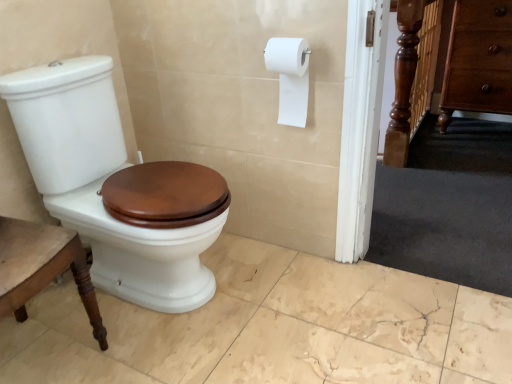
This screenshot has width=512, height=384. What do you see at coordinates (479, 58) in the screenshot?
I see `brown wood drawer at right` at bounding box center [479, 58].

Measure the distance between white glossy toilet at left and camera.

They are 1.28 meters apart.

The height and width of the screenshot is (384, 512). I want to click on white glossy toilet at left, so click(102, 183).

The width and height of the screenshot is (512, 384). I want to click on brown wood drawer at right, so click(x=479, y=58).

Considering the positions of objects white matte toilet paper at upper right and brown wood drawer at right in the image provided, who is more to the right, white matte toilet paper at upper right or brown wood drawer at right?

brown wood drawer at right is more to the right.

Considering the relative sizes of white matte toilet paper at upper right and brown wood drawer at right in the image provided, is white matte toilet paper at upper right wider than brown wood drawer at right?

No.

Considering the sizes of objects white matte toilet paper at upper right and brown wood drawer at right in the image provided, who is bigger, white matte toilet paper at upper right or brown wood drawer at right?

brown wood drawer at right is bigger.

Which is closer to the camera, (297,53) or (452,70)?

Point (297,53)

Which of these two, brown wood drawer at right or white matte toilet paper at upper right, is smaller?

white matte toilet paper at upper right.

Could you tell me if brown wood drawer at right is facing white matte toilet paper at upper right?

Yes, brown wood drawer at right is oriented towards white matte toilet paper at upper right.

Which is more to the left, brown wood drawer at right or white matte toilet paper at upper right?

white matte toilet paper at upper right.

Looking at their sizes, would you say brown wood drawer at right is wider or thinner than white matte toilet paper at upper right?

Clearly, brown wood drawer at right has more width compared to white matte toilet paper at upper right.

Is white glossy toilet at left thinner than brown wood drawer at right?

No, white glossy toilet at left is not thinner than brown wood drawer at right.

Would you say white glossy toilet at left is outside brown wood drawer at right?

white glossy toilet at left lies outside brown wood drawer at right's area.

Is white glossy toilet at left far from brown wood drawer at right?

Absolutely, white glossy toilet at left is distant from brown wood drawer at right.

Which object is further away from the camera, white glossy toilet at left or brown wood drawer at right?

brown wood drawer at right is behind.

Between white glossy toilet at left and white matte toilet paper at upper right, which one has less height?

white matte toilet paper at upper right.

Could you tell me if white glossy toilet at left is turned towards white matte toilet paper at upper right?

No, white glossy toilet at left is not turned towards white matte toilet paper at upper right.

Considering the relative sizes of white glossy toilet at left and white matte toilet paper at upper right in the image provided, is white glossy toilet at left smaller than white matte toilet paper at upper right?

No, white glossy toilet at left is not smaller than white matte toilet paper at upper right.

Between brown wood drawer at right and white glossy toilet at left, which one has larger width?

white glossy toilet at left.

Is brown wood drawer at right far away from white glossy toilet at left?

Yes, brown wood drawer at right and white glossy toilet at left are located far from each other.

Can you confirm if brown wood drawer at right is positioned to the right of white glossy toilet at left?

Yes, brown wood drawer at right is to the right of white glossy toilet at left.

You are a GUI agent. You are given a task and a screenshot of the screen. Output one action in this format:
    pyautogui.click(x=<x>, y=<y>)
    Task: Click on the porcelain on the left of brown wood drawer at right
    
    Given the screenshot: What is the action you would take?
    pyautogui.click(x=102, y=183)

From the image's perspective, is white matte toilet paper at upper right positioned above or below white glossy toilet at left?

white matte toilet paper at upper right is situated higher than white glossy toilet at left in the image.

The width and height of the screenshot is (512, 384). There is a white glossy toilet at left. Identify the location of toilet paper above it (from a real-world perspective). (290, 77).

How much distance is there between white matte toilet paper at upper right and white glossy toilet at left?

white matte toilet paper at upper right is 25.77 inches from white glossy toilet at left.

In terms of size, does white matte toilet paper at upper right appear bigger or smaller than white glossy toilet at left?

white matte toilet paper at upper right is smaller than white glossy toilet at left.

The image size is (512, 384). I want to click on drawer below the white matte toilet paper at upper right (from a real-world perspective), so click(479, 58).

Identify the location of drawer behind the white matte toilet paper at upper right. The image size is (512, 384). (479, 58).

Estimate the real-world distances between objects in this image. Which object is closer to white matte toilet paper at upper right, white glossy toilet at left or brown wood drawer at right?

Among the two, white glossy toilet at left is located nearer to white matte toilet paper at upper right.

Which object lies further to the anchor point white glossy toilet at left, brown wood drawer at right or white matte toilet paper at upper right?

brown wood drawer at right is positioned further to the anchor white glossy toilet at left.

Considering their positions, is white matte toilet paper at upper right positioned closer to brown wood drawer at right than white glossy toilet at left?

white matte toilet paper at upper right.

Which object lies nearer to the anchor point brown wood drawer at right, white glossy toilet at left or white matte toilet paper at upper right?

white matte toilet paper at upper right is positioned closer to the anchor brown wood drawer at right.

Estimate the real-world distances between objects in this image. Which object is closer to white glossy toilet at left, white matte toilet paper at upper right or brown wood drawer at right?

Among the two, white matte toilet paper at upper right is located nearer to white glossy toilet at left.

Looking at this image, estimate the real-world distances between objects in this image. Which object is closer to white matte toilet paper at upper right, brown wood drawer at right or white glossy toilet at left?

white glossy toilet at left is closer to white matte toilet paper at upper right.

Where is `toilet paper between white glossy toilet at left and brown wood drawer at right in the horizontal direction`? Image resolution: width=512 pixels, height=384 pixels. toilet paper between white glossy toilet at left and brown wood drawer at right in the horizontal direction is located at coordinates (290, 77).